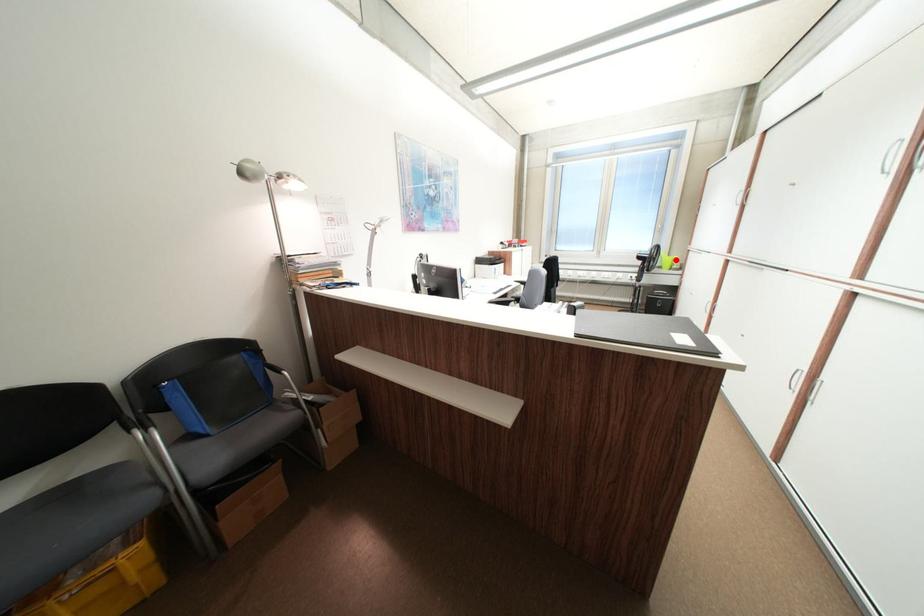
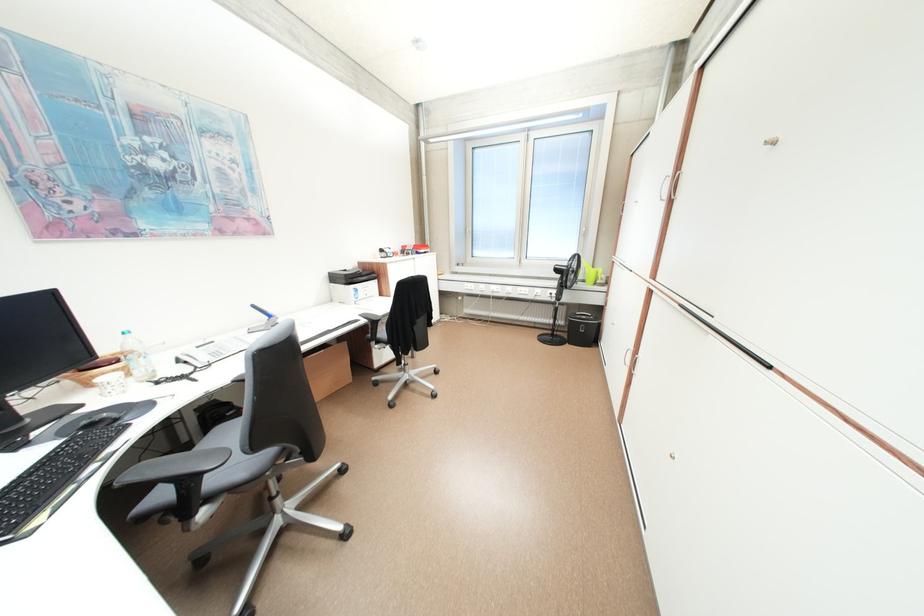
Where in the second image is the point corresponding to the highlighted location from the first image?

(598, 273)